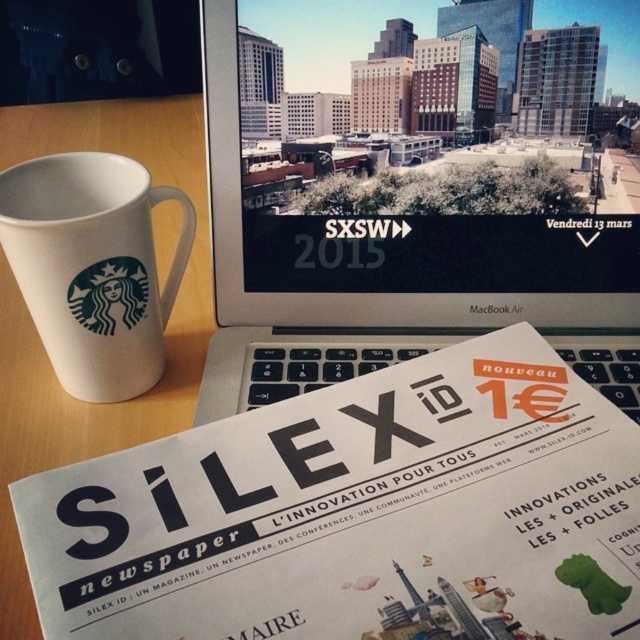
You are sitting at the desk and want to reach for the white glossy newspaper at center and the silver metallic laptop at center. Which object is easier to grab without moving your hand too much?

The white glossy newspaper at center is easier to grab because it is closer to the viewer than the silver metallic laptop at center.

You are setting up a new monitor stand that requires at least 2 inches of vertical space between the top of the laptop and the bottom of the stand. Given the height difference between the silver metallic laptop at center and the white ceramic mug at left, can you determine if the stand will fit?

The silver metallic laptop at center is taller than the white ceramic mug at left. Since the stand requires 2 inches of vertical space, but we don not have exact measurements, it is uncertain if the height difference meets the requirement. Additional measurements are needed.